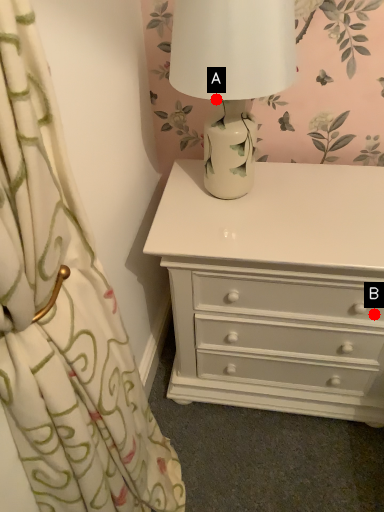
Question: Two points are circled on the image, labeled by A and B beside each circle. Which of the following is the closest to the observer?

Choices:
 (A) A is closer
 (B) B is closer

Answer: (A)